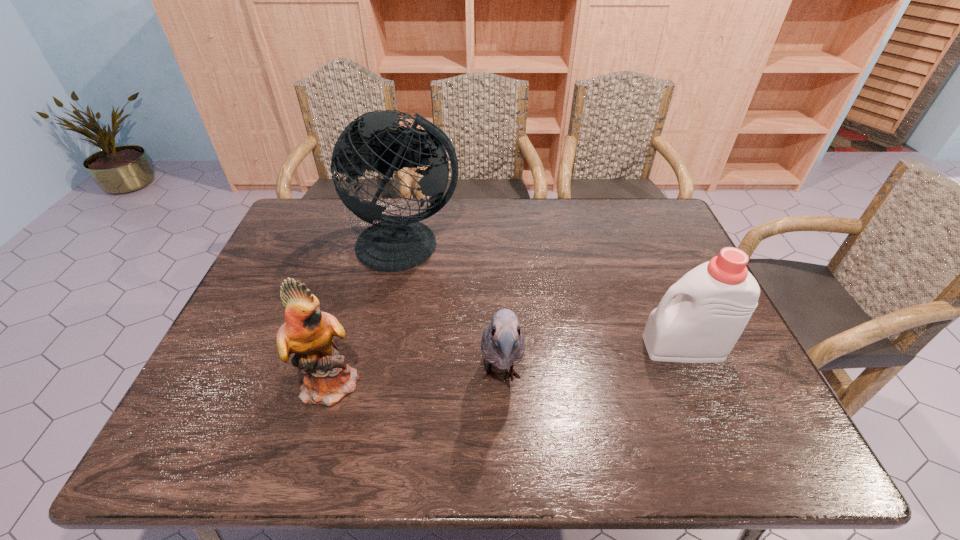
Find the location of `vacant space located on the handle side of the rightmost object`. vacant space located on the handle side of the rightmost object is located at coordinates (551, 347).

The image size is (960, 540). Identify the location of free space located on the handle side of the rightmost object. (551, 347).

Find the location of a particular element. The image size is (960, 540). blank area located 0.060m on the front-facing side of the right parrot is located at coordinates (504, 448).

At what (x,y) coordinates should I click in order to perform the action: click on object that is at the far edge. Please return your answer as a coordinate pair (x, y). This screenshot has width=960, height=540. Looking at the image, I should click on (396, 243).

What are the coordinates of `object positioned at the right edge` in the screenshot? It's located at (715, 300).

Where is `free space at the far edge`? free space at the far edge is located at coordinates (525, 233).

Identify the location of vacant space at the near edge. (675, 456).

You are a GUI agent. You are given a task and a screenshot of the screen. Output one action in this format:
    pyautogui.click(x=<x>, y=<y>)
    Task: Click on the free spot at the left edge of the desktop
    
    Given the screenshot: What is the action you would take?
    pyautogui.click(x=204, y=422)

The height and width of the screenshot is (540, 960). I want to click on vacant position at the right edge of the desktop, so click(x=643, y=268).

The width and height of the screenshot is (960, 540). Identify the location of blank space at the far right corner of the desktop. (650, 217).